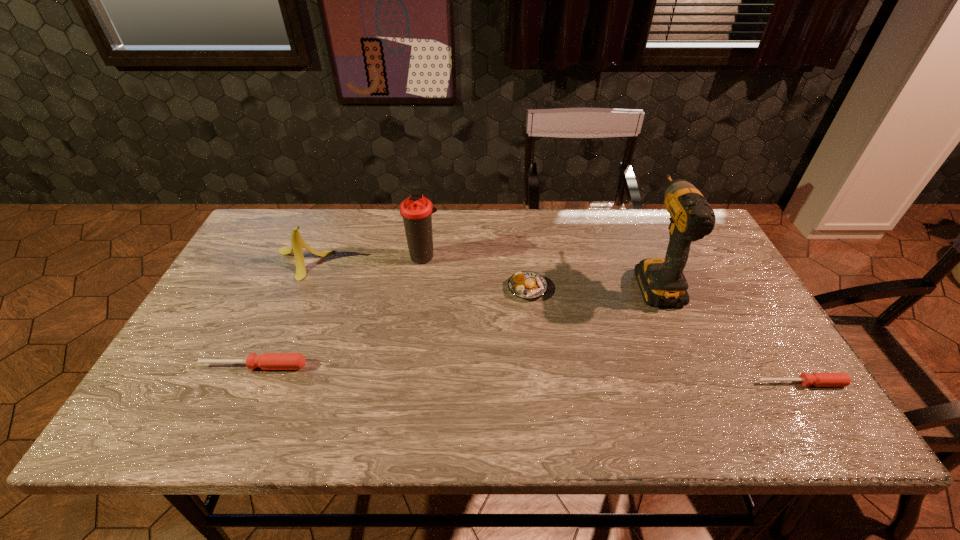
Image resolution: width=960 pixels, height=540 pixels. What are the coordinates of `vacant area at the right edge of the desktop` in the screenshot? It's located at (727, 330).

Find the location of a particular element. This screenshot has width=960, height=540. vacant position at the far left corner of the desktop is located at coordinates (269, 226).

Where is `free space at the near left corner`? This screenshot has width=960, height=540. free space at the near left corner is located at coordinates (159, 399).

Find the location of a particular element. vacant region at the far right corner of the desktop is located at coordinates (698, 246).

Locate an element on the screen. This screenshot has width=960, height=540. vacant area that lies between the drill and the shorter screwdriver is located at coordinates (729, 332).

Where is `free area in between the tallest object and the pastry`? free area in between the tallest object and the pastry is located at coordinates (591, 284).

Locate an element on the screen. The height and width of the screenshot is (540, 960). free space between the left screwdriver and the banana is located at coordinates (277, 315).

The image size is (960, 540). In order to click on free spot between the fifth shortest object and the banana in this screenshot , I will do `click(362, 260)`.

The image size is (960, 540). I want to click on free space between the pastry and the tallest object, so click(x=591, y=284).

The image size is (960, 540). I want to click on free space between the drill and the taller screwdriver, so click(454, 323).